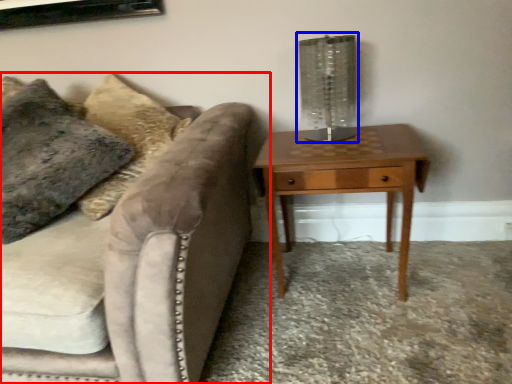
Question: Which object appears closest to the camera in this image, studio couch (highlighted by a red box) or table lamp (highlighted by a blue box)?

Choices:
 (A) studio couch
 (B) table lamp

Answer: (A)